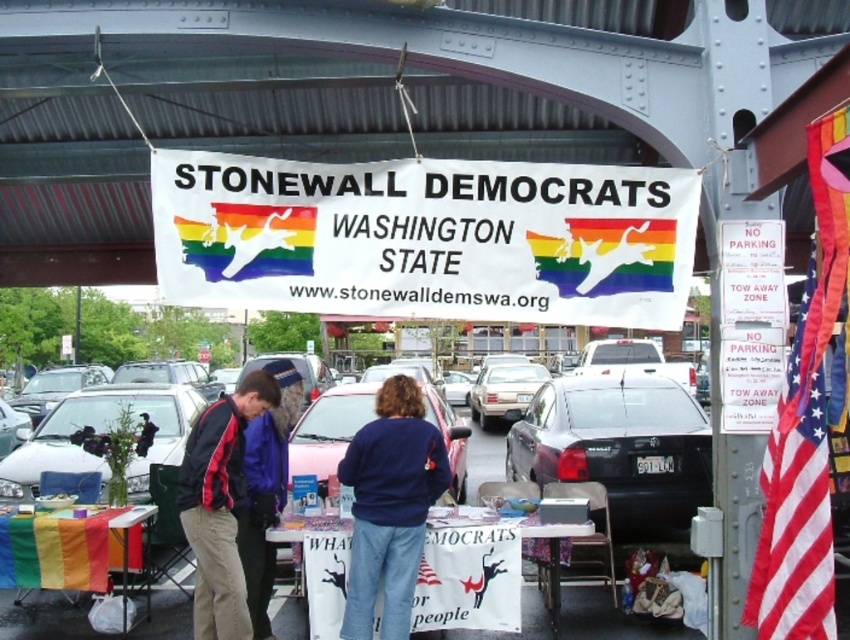
Can you confirm if blue fleece jacket at center is bigger than matte silver sedan at center?

Actually, blue fleece jacket at center might be smaller than matte silver sedan at center.

Is point (429, 483) positioned before point (514, 410)?

Yes, point (429, 483) is closer to viewer.

Between point (417, 440) and point (539, 371), which one is positioned in front?

Positioned in front is point (417, 440).

Where is `blue fleece jacket at center`? blue fleece jacket at center is located at coordinates (391, 506).

Which is in front, point (182, 500) or point (502, 390)?

Positioned in front is point (182, 500).

Between point (193, 432) and point (514, 403), which one is positioned behind?

Positioned behind is point (514, 403).

Is point (197, 625) closer to camera compared to point (471, 417)?

Yes, point (197, 625) is closer to viewer.

Locate an element on the screen. The width and height of the screenshot is (850, 640). red and black jacket at center is located at coordinates (219, 506).

Is white metal overpass at upper center shorter than white glossy car at lower left?

Yes.

Between point (131, 259) and point (174, 385), which one is positioned behind?

The point (174, 385) is more distant.

At what (x,y) coordinates should I click in order to perform the action: click on white metal overpass at upper center. Please return your answer as a coordinate pair (x, y). Looking at the image, I should click on (353, 97).